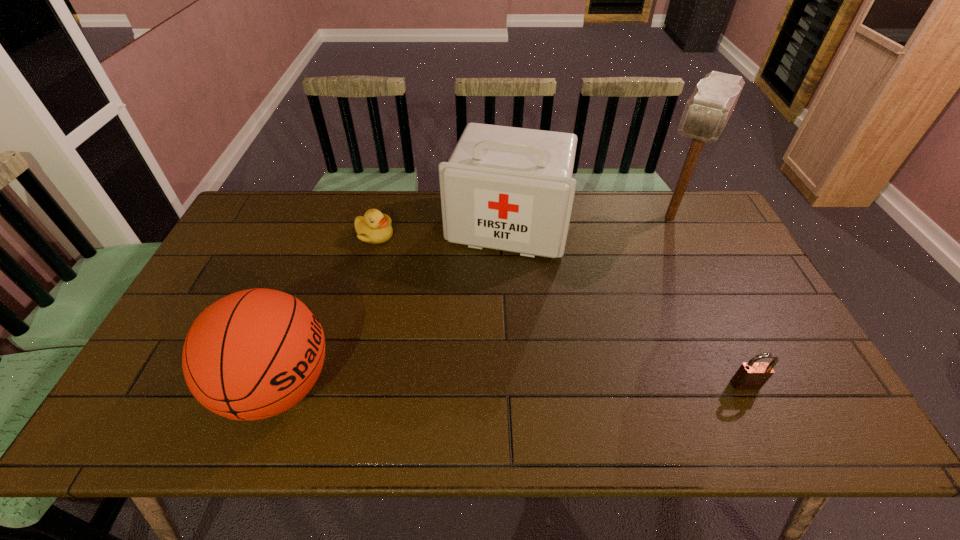
Find the location of a particular element. This screenshot has width=960, height=540. free spot located 0.400m above the head of the tallest object is located at coordinates (617, 318).

The width and height of the screenshot is (960, 540). In order to click on free space located above the head of the tallest object in this screenshot , I will do `click(652, 254)`.

Locate an element on the screen. Image resolution: width=960 pixels, height=540 pixels. vacant area situated 0.090m above the head of the tallest object is located at coordinates (653, 252).

The width and height of the screenshot is (960, 540). Identify the location of vacant region located on the front-facing side of the first-aid kit. (475, 328).

At what (x,y) coordinates should I click in order to perform the action: click on free region located on the front-facing side of the first-aid kit. Please return your answer as a coordinate pair (x, y). Looking at the image, I should click on (473, 337).

The image size is (960, 540). I want to click on vacant position located on the front-facing side of the first-aid kit, so click(464, 369).

Image resolution: width=960 pixels, height=540 pixels. Find the location of `duckling positioned at the far edge`. duckling positioned at the far edge is located at coordinates (374, 228).

Identify the location of mallet present at the far edge. (707, 111).

The width and height of the screenshot is (960, 540). Identify the location of the first-aid kit at the far edge. (506, 188).

This screenshot has height=540, width=960. Find the location of `basketball that is positioned at the near edge`. basketball that is positioned at the near edge is located at coordinates (251, 355).